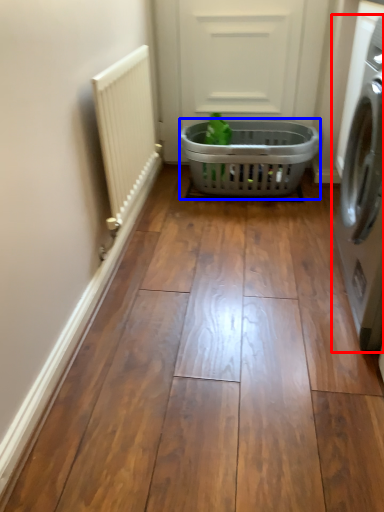
Question: Which of the following is the closest to the observer, washing machine (highlighted by a red box) or basket (highlighted by a blue box)?

Choices:
 (A) washing machine
 (B) basket

Answer: (A)